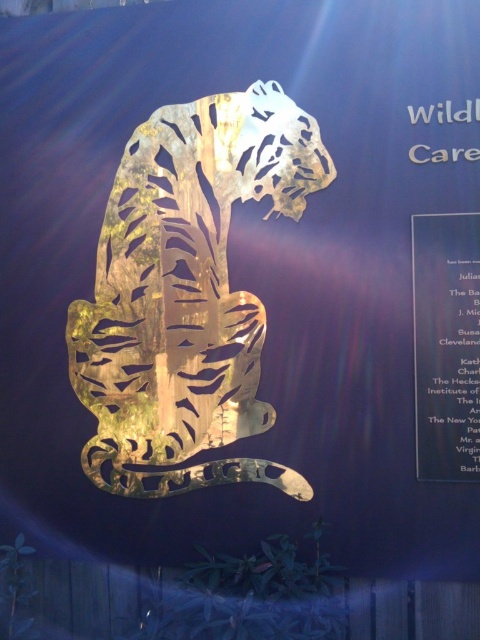
Is point (236, 177) positioned after point (459, 316)?

Yes, it is behind point (459, 316).

Which is behind, point (239, 371) or point (421, 326)?

The point (239, 371) is behind.

I want to click on gold reflective tiger at center, so click(187, 292).